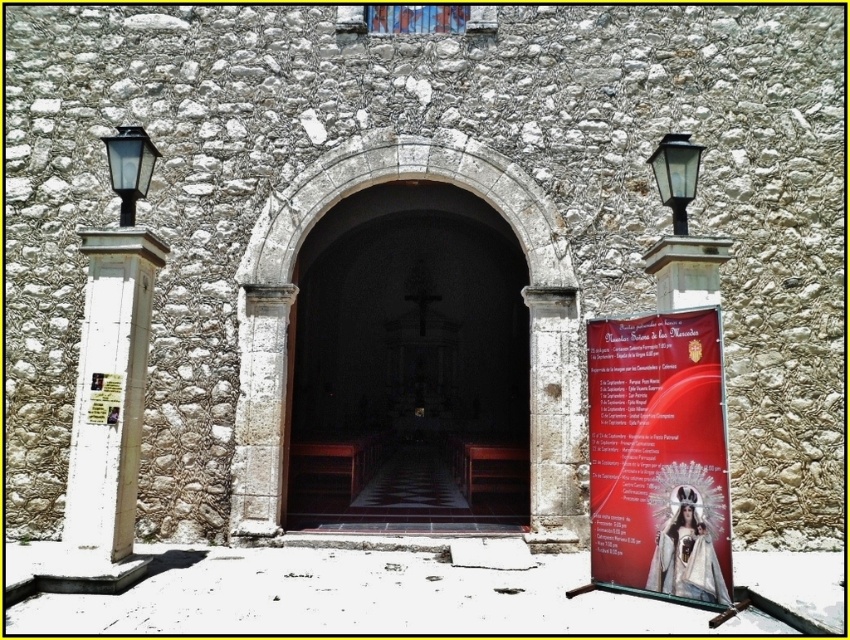
Between red glossy poster at right and white stone door at left, which one has more height?

Standing taller between the two is white stone door at left.

Who is higher up, red glossy poster at right or white stone door at left?

Positioned higher is white stone door at left.

Does point (690, 346) come behind point (95, 314)?

That is False.

Locate an element on the screen. red glossy poster at right is located at coordinates (658, 456).

Consider the image. Can you confirm if white stone door at left is thinner than black glass lamp at left?

No.

Who is more distant from viewer, (140, 266) or (122, 211)?

The point (122, 211) is more distant.

Where is `white stone door at left`? This screenshot has height=640, width=850. white stone door at left is located at coordinates (109, 394).

Identify the location of white stone door at left. (109, 394).

Between dark wood door at center and matte red poster at right, which one is positioned lower?

dark wood door at center is lower down.

In the scene shown: Is dark wood door at center to the right of matte red poster at right from the viewer's perspective?

Correct, you'll find dark wood door at center to the right of matte red poster at right.

Locate an element on the screen. The height and width of the screenshot is (640, 850). dark wood door at center is located at coordinates (408, 364).